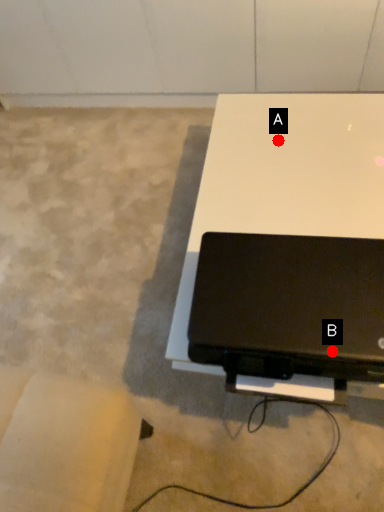
Question: Two points are circled on the image, labeled by A and B beside each circle. Which point appears closest to the camera in this image?

Choices:
 (A) A is closer
 (B) B is closer

Answer: (B)